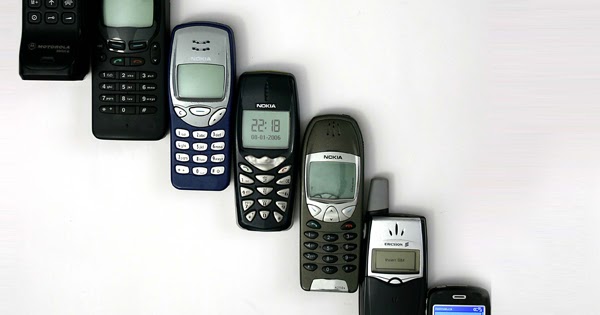
Find the location of a particular element. The width and height of the screenshot is (600, 315). phone is located at coordinates (48, 24), (119, 40), (202, 84), (267, 153), (325, 195), (399, 259), (457, 302).